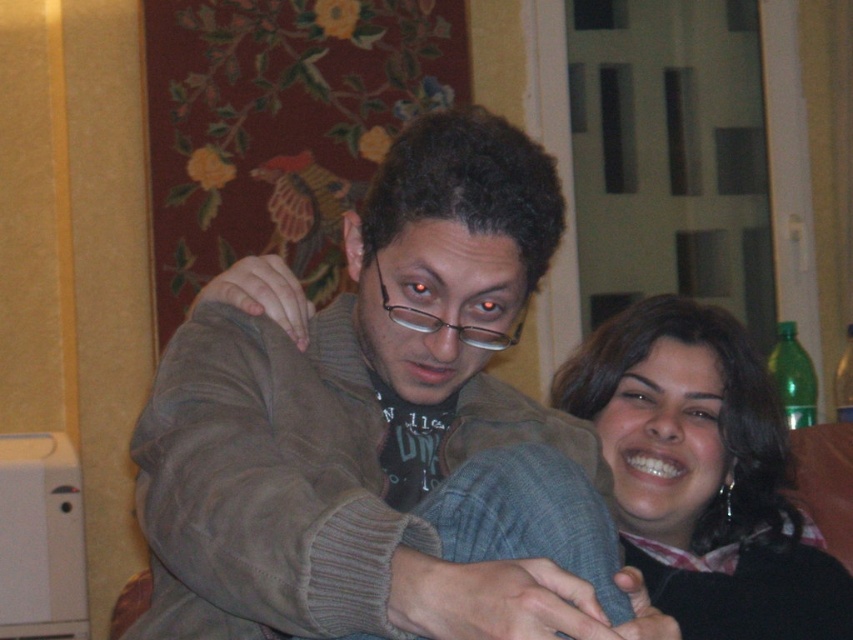
Consider the image. Which is below, brown suede jacket at center or black matte hair at upper right?

Positioned lower is black matte hair at upper right.

Measure the distance between brown suede jacket at center and camera.

A distance of 75.73 centimeters exists between brown suede jacket at center and camera.

Image resolution: width=853 pixels, height=640 pixels. What are the coordinates of `brown suede jacket at center` in the screenshot? It's located at (369, 420).